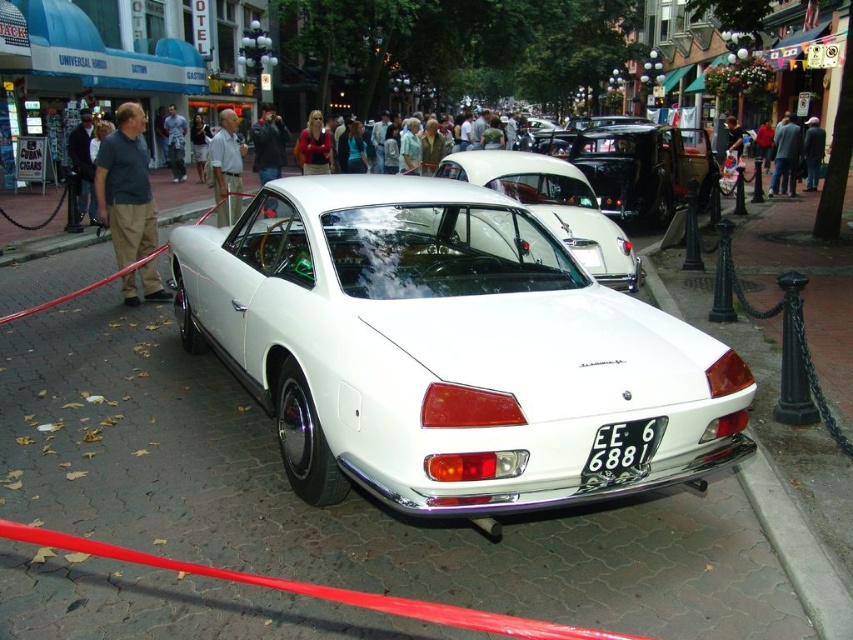
Question: Is white matte car at center further to the viewer compared to black metal license plate at center?

Choices:
 (A) no
 (B) yes

Answer: (B)

Question: Which point appears farthest from the camera in this image?

Choices:
 (A) (309, 160)
 (B) (262, 218)

Answer: (A)

Question: Among these objects, which one is nearest to the camera?

Choices:
 (A) black metal license plate at center
 (B) matte gray shirt at center
 (C) dark blue shirt at center

Answer: (A)

Question: Is white matte car at center wider than gray shirt at center?

Choices:
 (A) yes
 (B) no

Answer: (B)

Question: Can you confirm if dark blue jacket at center is positioned to the left of denim jacket at center?

Choices:
 (A) yes
 (B) no

Answer: (B)

Question: Which point is farther to the camera?

Choices:
 (A) denim jacket at center
 (B) matte gray shirt at center
 (C) white glossy car at center
 (D) matte red sweater at center

Answer: (A)